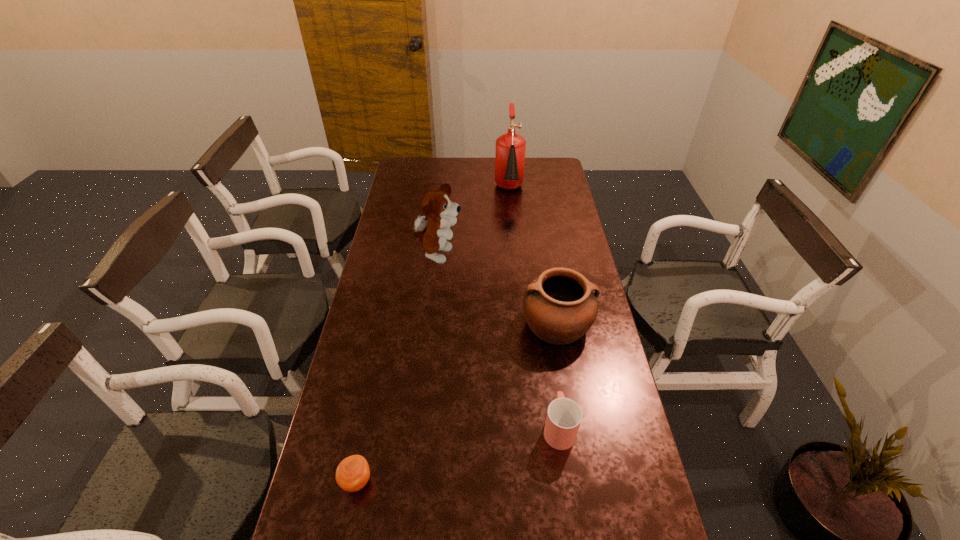
You are a GUI agent. You are given a task and a screenshot of the screen. Output one action in this format:
    pyautogui.click(x=<x>, y=<y>)
    Task: Click on the vacant area between the nearest object and the cup
    The image size is (960, 540).
    Given the screenshot: What is the action you would take?
    pyautogui.click(x=458, y=454)

This screenshot has width=960, height=540. Identify the location of unoccupied position between the cup and the nearest object. coord(458,454).

Locate an element on the screen. This screenshot has height=540, width=960. free area in between the shortest object and the fourth object from right to left is located at coordinates (397, 368).

You are a GUI agent. You are given a task and a screenshot of the screen. Output one action in this format:
    pyautogui.click(x=<x>, y=<y>)
    Task: Click on the free space between the third nearest object and the second nearest object
    
    Given the screenshot: What is the action you would take?
    pyautogui.click(x=558, y=376)

Find the location of `free space between the leftmost object and the puppy`. free space between the leftmost object and the puppy is located at coordinates (397, 368).

Where is `object that is the second closest one to the second shortest object`? Image resolution: width=960 pixels, height=540 pixels. object that is the second closest one to the second shortest object is located at coordinates (352, 474).

Select which object appears as the closest to the cup. Please provide its 2D coordinates. Your answer should be formatted as a tuple, i.e. [(x, y)], where the tuple contains the x and y coordinates of a point satisfying the conditions above.

[(560, 306)]

This screenshot has height=540, width=960. What are the coordinates of `blank space that satisfies the following two spatial constraints: 1. on the face of the puppy; 2. on the side of the cup with the handle` in the screenshot? It's located at (420, 428).

You are a GUI agent. You are given a task and a screenshot of the screen. Output one action in this format:
    pyautogui.click(x=<x>, y=<y>)
    Task: Click on the free space that satisfies the following two spatial constraints: 1. with the nozzle aimed from the tallest object; 2. on the left side of the third nearest object
    
    Given the screenshot: What is the action you would take?
    pyautogui.click(x=521, y=324)

Locate an element on the screen. The width and height of the screenshot is (960, 540). vacant region that satisfies the following two spatial constraints: 1. on the side of the cup with the handle; 2. on the right side of the third nearest object is located at coordinates click(544, 324).